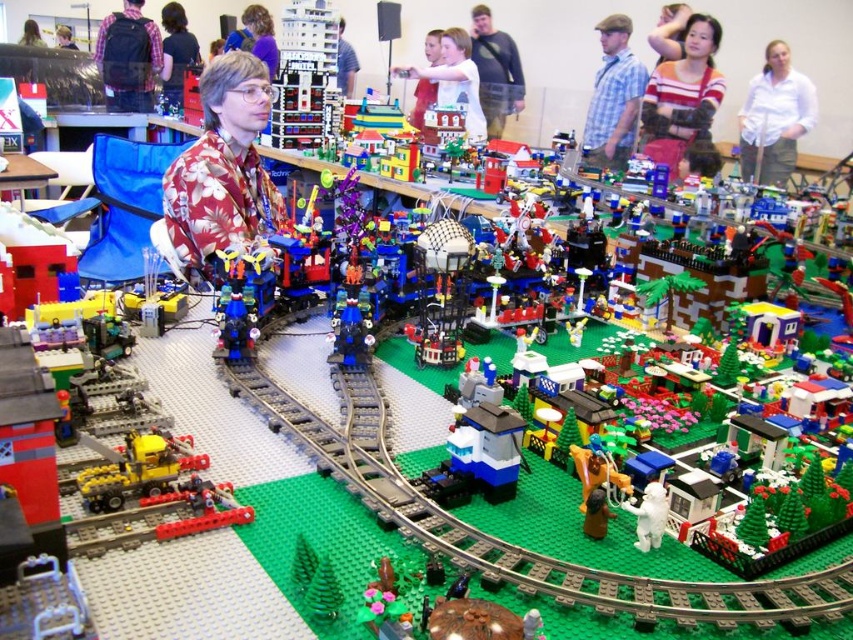
Identify the location of floral shirt at center. The image size is (853, 640). (219, 172).

Looking at this image, who is positioned more to the left, floral shirt at center or matte black backpack at upper left?

Positioned to the left is matte black backpack at upper left.

Which is behind, point (250, 232) or point (126, 77)?

Point (126, 77)

What are the coordinates of `floral shirt at center` in the screenshot? It's located at (219, 172).

Is floral shirt at center above matte blue shirt at center?

Incorrect, floral shirt at center is not positioned above matte blue shirt at center.

Between point (183, 268) and point (344, 83), which one is positioned in front?

Point (183, 268) is in front.

Locate an element on the screen. Image resolution: width=853 pixels, height=640 pixels. floral shirt at center is located at coordinates (219, 172).

Is blue plastic train at center positioned at the back of smooth white shirt at center?

That is False.

Is point (485, 426) more distant than point (428, 48)?

No.

Measure the distance between point (x=500, y=499) and camera.

Point (x=500, y=499) is 34.82 inches away from camera.

Identify the location of blue plastic train at center. The image size is (853, 640). (488, 449).